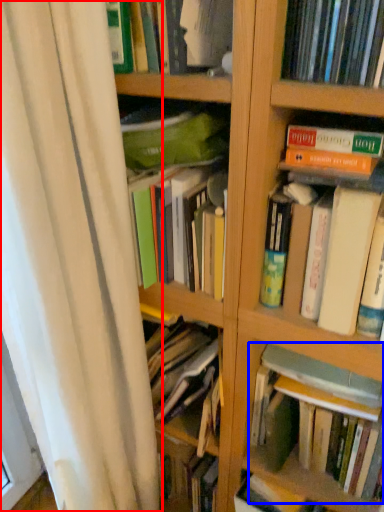
Question: Which point is further to the camera, shower curtain (highlighted by a red box) or book (highlighted by a blue box)?

Choices:
 (A) shower curtain
 (B) book

Answer: (B)